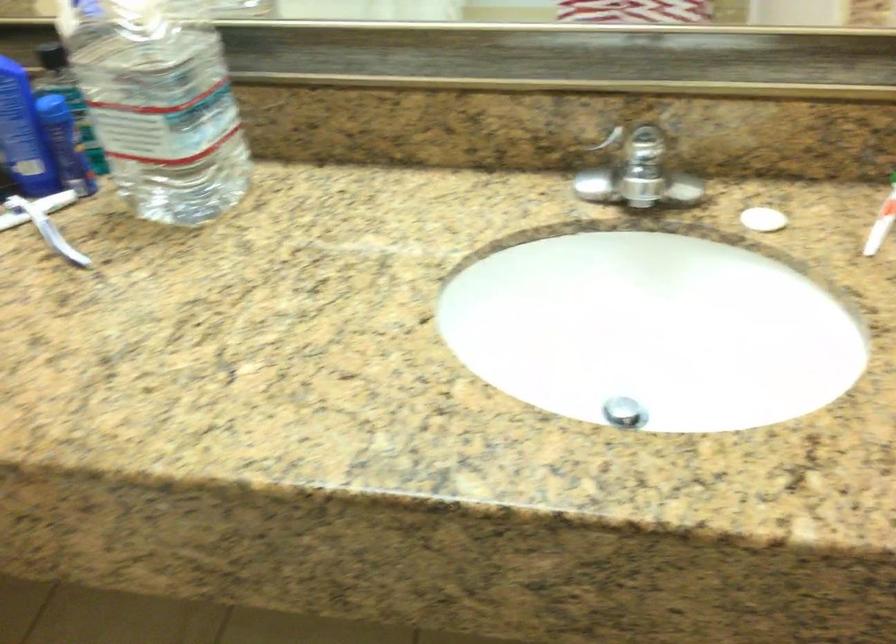
The width and height of the screenshot is (896, 644). I want to click on metal faucet handle, so click(599, 144).